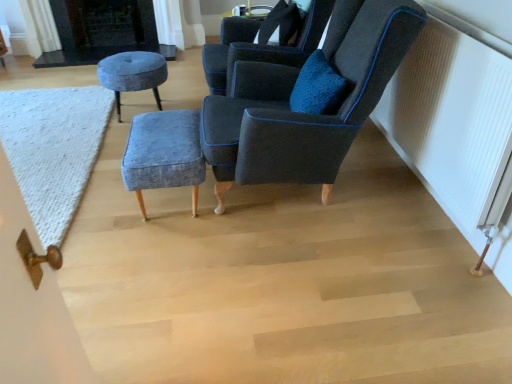
This screenshot has width=512, height=384. What are the coordinates of `vacant area on top of denim fabric stool at center, placed as the first stool when sorted from bottom to top (from a real-world perspective)` in the screenshot? It's located at (160, 135).